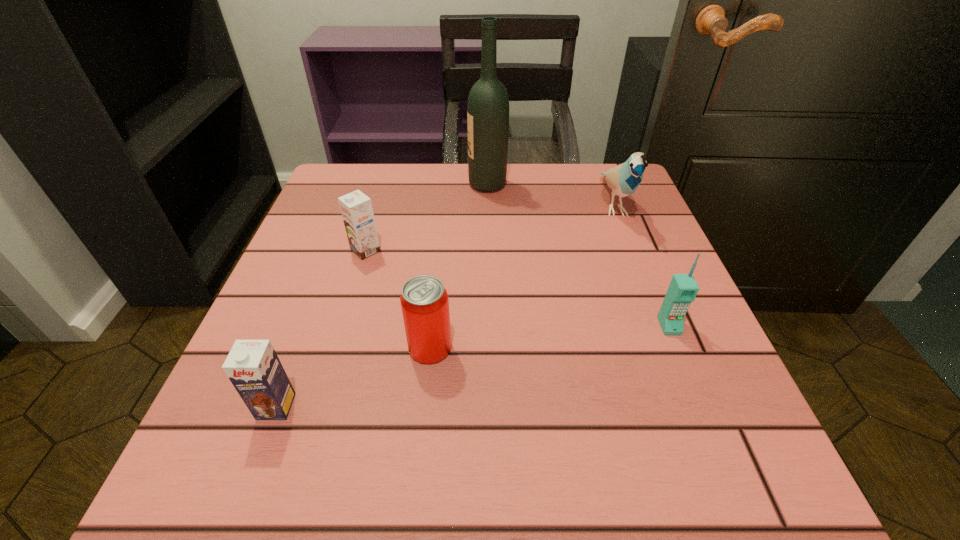
Locate an element on the screen. The width and height of the screenshot is (960, 540). free space between the farther chocolate milk and the cellular telephone is located at coordinates (517, 288).

This screenshot has height=540, width=960. What are the coordinates of `empty space that is in between the cellular telephone and the bird` in the screenshot? It's located at (641, 265).

Where is `vacant area that lies between the bird and the right chocolate milk`? vacant area that lies between the bird and the right chocolate milk is located at coordinates (490, 228).

You are a GUI agent. You are given a task and a screenshot of the screen. Output one action in this format:
    pyautogui.click(x=<x>, y=<y>)
    Task: Click on the vacant area between the can and the right chocolate milk
    
    Given the screenshot: What is the action you would take?
    pyautogui.click(x=397, y=299)

Where is `vacant space in between the fourth object from left to right and the right chocolate milk`? This screenshot has height=540, width=960. vacant space in between the fourth object from left to right and the right chocolate milk is located at coordinates (426, 218).

At what (x,y) coordinates should I click in order to perform the action: click on vacant area between the third object from right to left and the leftmost object. Please return your answer as a coordinate pair (x, y). The height and width of the screenshot is (540, 960). Looking at the image, I should click on tap(382, 295).

Where is `free space between the tallest object and the farther chocolate milk`? free space between the tallest object and the farther chocolate milk is located at coordinates (426, 218).

At what (x,y) coordinates should I click in order to perform the action: click on free space between the tallest object and the nearest object. Please return your answer as a coordinate pair (x, y). The width and height of the screenshot is (960, 540). Looking at the image, I should click on (382, 295).

The width and height of the screenshot is (960, 540). Identify the location of object that is the fifth closest to the leftmost object. (624, 179).

The image size is (960, 540). Find the location of `object identified as the third closest to the bird`. object identified as the third closest to the bird is located at coordinates (424, 301).